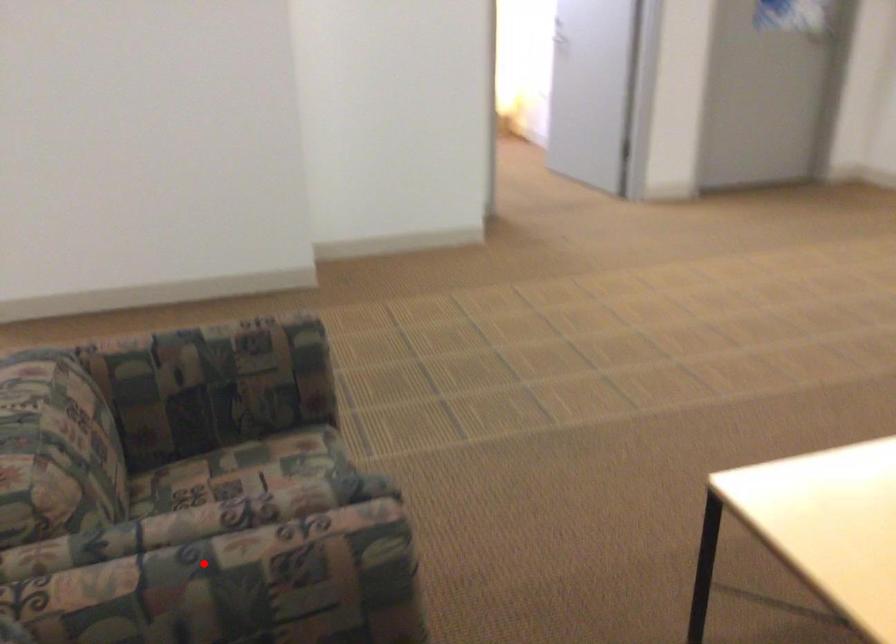
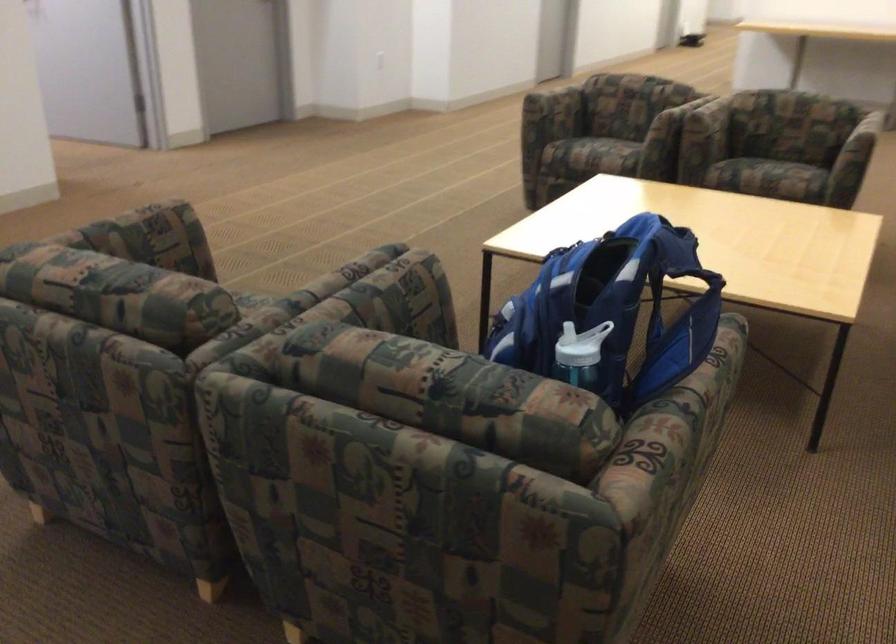
The point at the highlighted location is marked in the first image. Where is the corresponding point in the second image?

(362, 292)